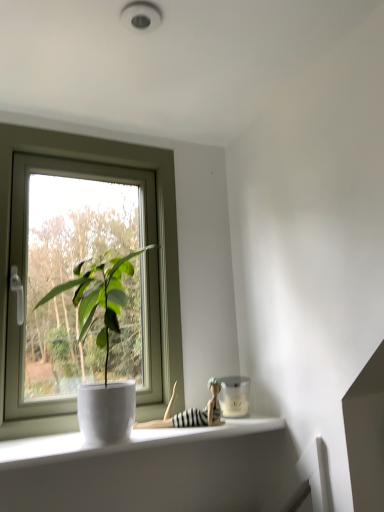
Question: Are striped fabric doll at lower center and white glossy pot at window beside each other?

Choices:
 (A) no
 (B) yes

Answer: (A)

Question: From the image's perspective, is striped fabric doll at lower center located beneath white glossy pot at window?

Choices:
 (A) yes
 (B) no

Answer: (A)

Question: Is striped fabric doll at lower center positioned with its back to white glossy pot at window?

Choices:
 (A) yes
 (B) no

Answer: (B)

Question: From a real-world perspective, does striped fabric doll at lower center sit lower than white glossy pot at window?

Choices:
 (A) no
 (B) yes

Answer: (B)

Question: Can you confirm if striped fabric doll at lower center is positioned to the right of white glossy pot at window?

Choices:
 (A) yes
 (B) no

Answer: (A)

Question: Considering the relative sizes of striped fabric doll at lower center and white glossy pot at window in the image provided, is striped fabric doll at lower center bigger than white glossy pot at window?

Choices:
 (A) yes
 (B) no

Answer: (B)

Question: Can you confirm if white glossy window sill at lower left is positioned to the left of white glossy pot at window?

Choices:
 (A) yes
 (B) no

Answer: (B)

Question: Can you confirm if white glossy window sill at lower left is wider than white glossy pot at window?

Choices:
 (A) no
 (B) yes

Answer: (A)

Question: Is white glossy pot at window surrounded by white glossy window sill at lower left?

Choices:
 (A) yes
 (B) no

Answer: (B)

Question: Is white glossy window sill at lower left to the right of white glossy pot at window from the viewer's perspective?

Choices:
 (A) yes
 (B) no

Answer: (A)

Question: From a real-world perspective, is white glossy window sill at lower left over white glossy pot at window?

Choices:
 (A) yes
 (B) no

Answer: (B)

Question: Does white glossy window sill at lower left lie in front of white glossy pot at window?

Choices:
 (A) yes
 (B) no

Answer: (B)

Question: Could white plastic window at left be considered to be inside white glossy pot at window?

Choices:
 (A) yes
 (B) no

Answer: (B)